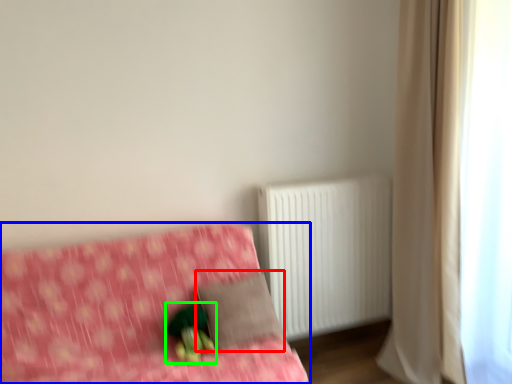
Question: Which object is positioned farthest from pillow (highlighted by a red box)? Select from furniture (highlighted by a blue box) and figurine (highlighted by a green box).

Choices:
 (A) furniture
 (B) figurine

Answer: (A)